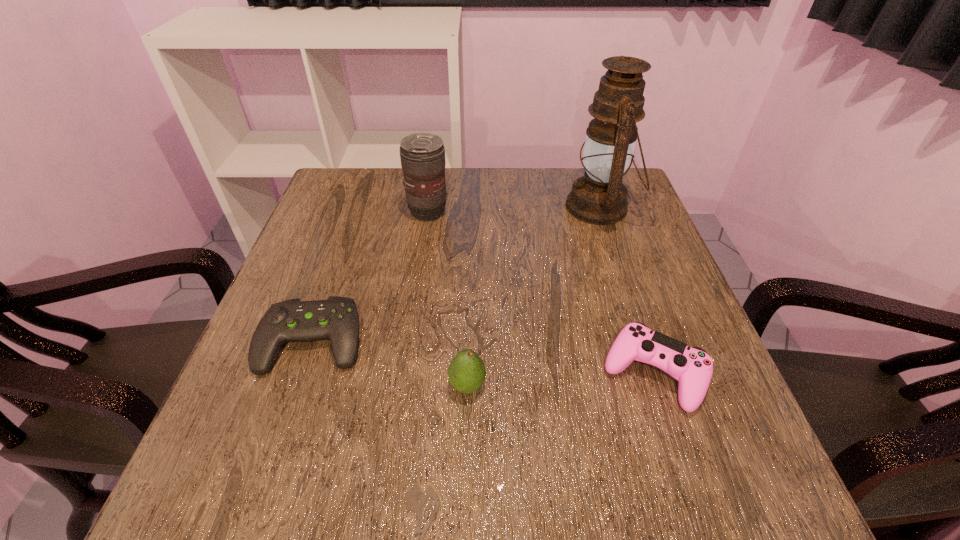
I want to click on free space located 0.400m on the side of the telephoto lens where the control switches are located, so (599, 211).

What are the coordinates of `vacant space located 0.270m on the right of the third shortest object` in the screenshot? It's located at (637, 386).

The height and width of the screenshot is (540, 960). In order to click on vacant region located on the front of the taller control in this screenshot , I will do `click(689, 483)`.

Where is `blank area located on the back of the left control`? This screenshot has width=960, height=540. blank area located on the back of the left control is located at coordinates (333, 282).

This screenshot has height=540, width=960. I want to click on oil lamp present at the far edge, so click(x=599, y=197).

Find the location of a particular element. The height and width of the screenshot is (540, 960). telephoto lens present at the far edge is located at coordinates (422, 155).

The image size is (960, 540). I want to click on object that is at the left edge, so click(337, 319).

Locate an element on the screen. oil lamp that is at the right edge is located at coordinates (599, 197).

Locate an element on the screen. control located at the right edge is located at coordinates click(692, 366).

Where is `object that is at the far right corner`? The image size is (960, 540). object that is at the far right corner is located at coordinates (599, 197).